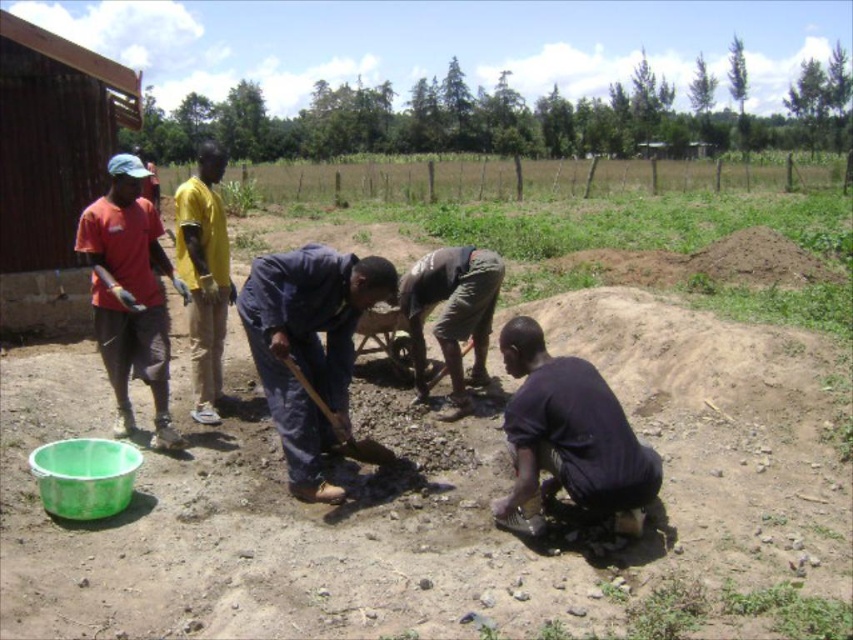
Is dark blue jeans at center to the right of matte red shirt at left from the viewer's perspective?

Correct, you'll find dark blue jeans at center to the right of matte red shirt at left.

Who is positioned more to the left, dark blue jeans at center or matte red shirt at left?

matte red shirt at left is more to the left.

Does point (357, 282) come behind point (152, 268)?

No, it is in front of (152, 268).

At what (x,y) coordinates should I click in order to perform the action: click on dark blue jeans at center. Please return your answer as a coordinate pair (x, y). Looking at the image, I should click on (309, 346).

The width and height of the screenshot is (853, 640). What do you see at coordinates (567, 436) in the screenshot?
I see `dark blue shirt at lower right` at bounding box center [567, 436].

Where is `dark blue shirt at lower right`? Image resolution: width=853 pixels, height=640 pixels. dark blue shirt at lower right is located at coordinates (567, 436).

What do you see at coordinates (567, 436) in the screenshot? I see `dark blue shirt at lower right` at bounding box center [567, 436].

Locate an element on the screen. dark blue shirt at lower right is located at coordinates (567, 436).

Is dark blue shirt at lower right wider than yellow fabric shirt at center?

No.

From the picture: Which of these two, dark blue shirt at lower right or yellow fabric shirt at center, stands shorter?

With less height is dark blue shirt at lower right.

Describe the element at coordinates (567, 436) in the screenshot. The width and height of the screenshot is (853, 640). I see `dark blue shirt at lower right` at that location.

Image resolution: width=853 pixels, height=640 pixels. Find the location of `dark blue shirt at lower right`. dark blue shirt at lower right is located at coordinates (567, 436).